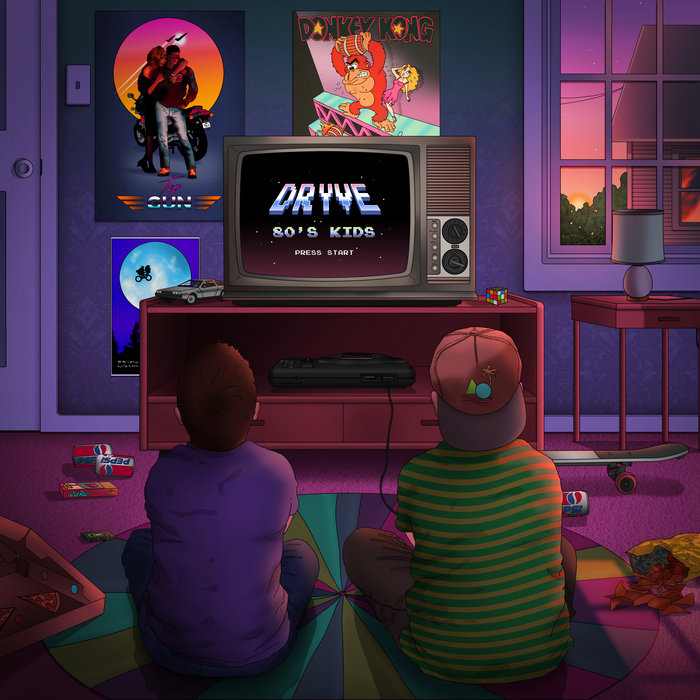
Locate an element on the screen. game system is located at coordinates (362, 360).